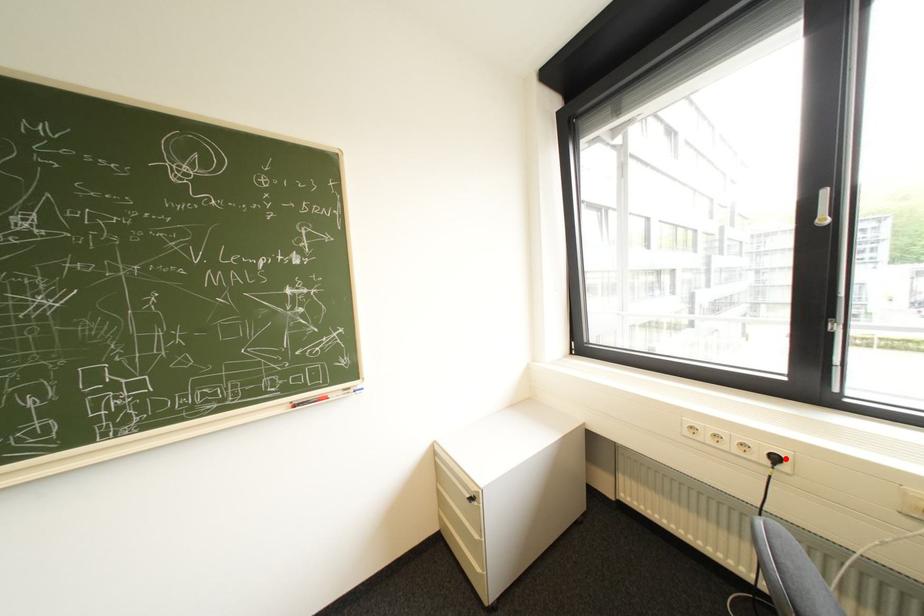
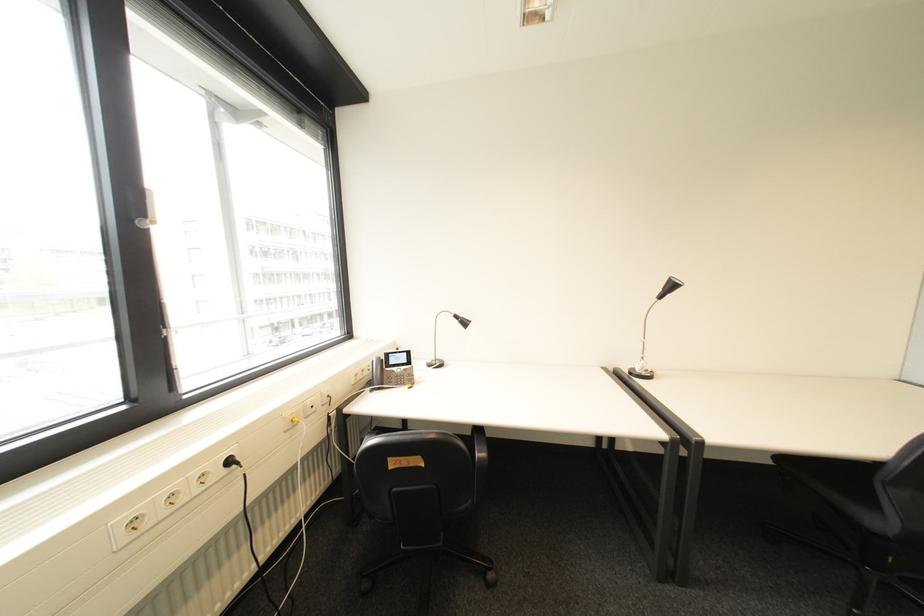
The point at the highlighted location is marked in the first image. Where is the corresponding point in the second image?

(239, 463)